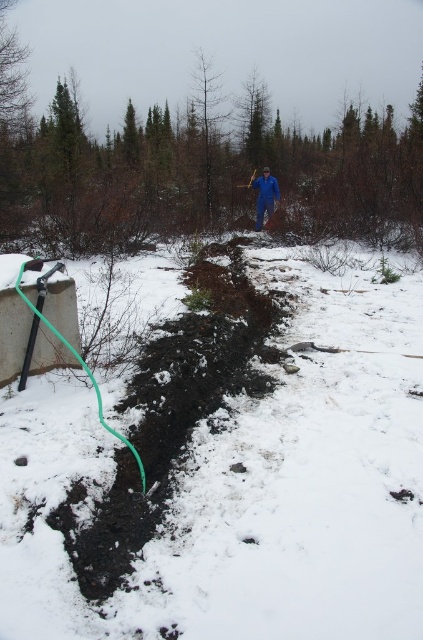
You are standing in the snowy forest and see the black soil at center and the blue fabric person at center. Which object is closer to the ground?

The black soil at center is positioned under the blue fabric person at center, so it is closer to the ground.

You are a gardener preparing to water plants in a winter garden. You see the point marked at coordinate (77, 362) which corresponds to a green rubber garden hose at lower left. Is the garden hose near the trench or away from the trench?

The point marked at coordinate (77, 362) indicates the green rubber garden hose at lower left, which is located away from the trench since the trench is at lower center as described in the scene.